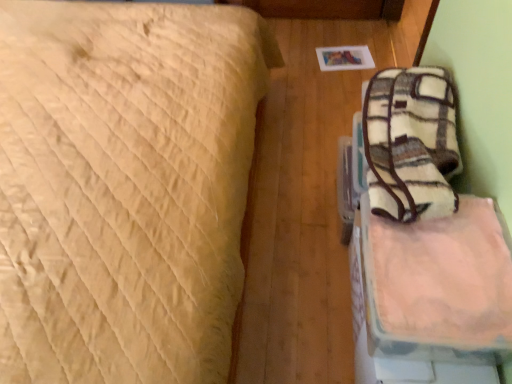
Question: Is beige quilted bed at upper left taller or shorter than pink fabric bag at right?

Choices:
 (A) short
 (B) tall

Answer: (B)

Question: From a real-world perspective, is beige quilted bed at upper left physically located above or below pink fabric bag at right?

Choices:
 (A) above
 (B) below

Answer: (A)

Question: Would you say beige quilted bed at upper left is inside or outside pink fabric bag at right?

Choices:
 (A) inside
 (B) outside

Answer: (B)

Question: Is pink fabric bag at right bigger or smaller than beige quilted bed at upper left?

Choices:
 (A) small
 (B) big

Answer: (A)

Question: From a real-world perspective, relative to beige quilted bed at upper left, is pink fabric bag at right vertically above or below?

Choices:
 (A) above
 (B) below

Answer: (B)

Question: From the image's perspective, relative to beige quilted bed at upper left, is pink fabric bag at right above or below?

Choices:
 (A) above
 (B) below

Answer: (B)

Question: Considering the positions of point (382, 268) and point (209, 77), is point (382, 268) closer or farther from the camera than point (209, 77)?

Choices:
 (A) farther
 (B) closer

Answer: (B)